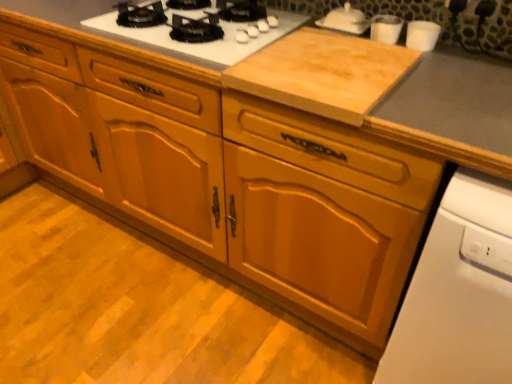
This screenshot has width=512, height=384. What are the coordinates of `free space in front of clear glass cups at upper right, the 2th appliance viewed from the right` in the screenshot? It's located at (396, 56).